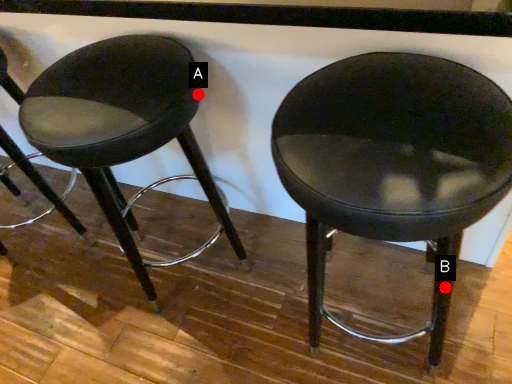
Question: Two points are circled on the image, labeled by A and B beside each circle. Which of the following is the farthest from the observer?

Choices:
 (A) A is further
 (B) B is further

Answer: (A)